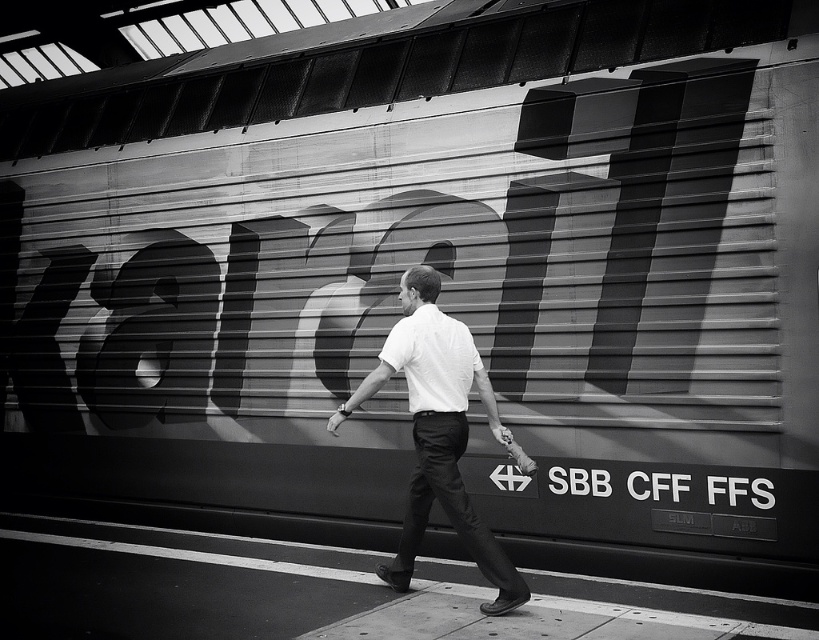
Based on the photo, you are standing at the point marked as point (279, 552) in the image. You want to take a photo of the train displayed with the word KAND and the logo with two interlocking arrows and SBB CFF FFS. Is the train visible in your current position?

The point (279, 552) is 5.14 meters away from the camera. Since the train is on the platform where the man is walking, it is likely visible from that position.

You are taking a photo of the train at the station. You want to focus on both the point at coordinate point [48,586] and the point at coordinate point [428,497]. Which point should you focus on first to ensure both are in focus?

You should focus on point [48,586] first because it is closer to the camera than point [428,497]. By focusing on the closer point, the farther point will also be in focus due to the depth of field.